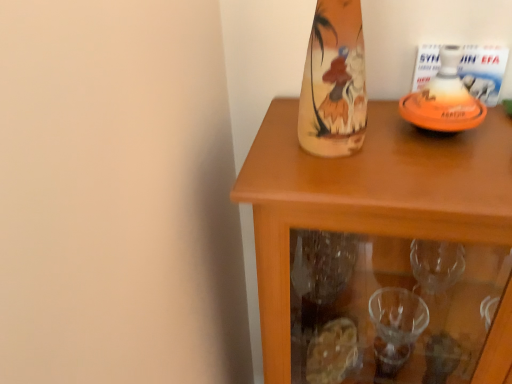
Question: Is wooden cabinet at upper right turned away from orange matte bottle at upper right?

Choices:
 (A) no
 (B) yes

Answer: (A)

Question: Is wooden cabinet at upper right facing towards orange matte bottle at upper right?

Choices:
 (A) yes
 (B) no

Answer: (B)

Question: Does wooden cabinet at upper right have a greater height compared to orange matte bottle at upper right?

Choices:
 (A) no
 (B) yes

Answer: (B)

Question: Can you confirm if wooden cabinet at upper right is thinner than orange matte bottle at upper right?

Choices:
 (A) yes
 (B) no

Answer: (B)

Question: Can you confirm if wooden cabinet at upper right is positioned to the left of orange matte bottle at upper right?

Choices:
 (A) yes
 (B) no

Answer: (B)

Question: From a real-world perspective, is wooden cabinet at upper right physically below orange matte bottle at upper right?

Choices:
 (A) no
 (B) yes

Answer: (B)

Question: Does orange matte bottle at upper right appear on the left side of wooden cabinet at upper right?

Choices:
 (A) yes
 (B) no

Answer: (A)

Question: Does orange matte bottle at upper right have a greater width compared to wooden cabinet at upper right?

Choices:
 (A) yes
 (B) no

Answer: (B)

Question: From a real-world perspective, is orange matte bottle at upper right positioned over wooden cabinet at upper right based on gravity?

Choices:
 (A) yes
 (B) no

Answer: (A)

Question: Is wooden cabinet at upper right surrounded by orange matte bottle at upper right?

Choices:
 (A) yes
 (B) no

Answer: (B)

Question: Does orange matte bottle at upper right have a larger size compared to wooden cabinet at upper right?

Choices:
 (A) yes
 (B) no

Answer: (B)

Question: Does orange matte bottle at upper right have a greater height compared to wooden cabinet at upper right?

Choices:
 (A) no
 (B) yes

Answer: (A)

Question: Is wooden cabinet at upper right in front of or behind orange matte bottle at upper right in the image?

Choices:
 (A) front
 (B) behind

Answer: (A)